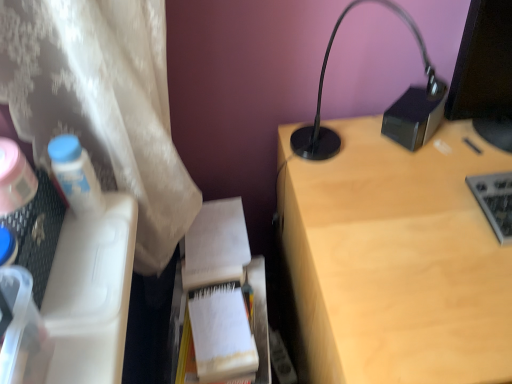
Where is `free space above light wood desk at upper right (from a real-world perspective)`? free space above light wood desk at upper right (from a real-world perspective) is located at coordinates (432, 208).